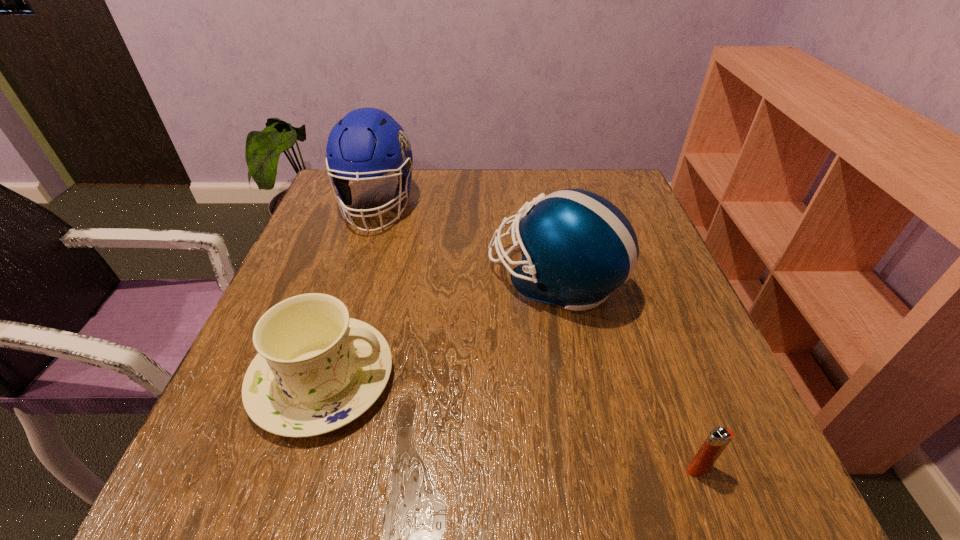
What are the coordinates of `vacant area that lies between the nearer football helmet and the third tallest object` in the screenshot? It's located at (439, 329).

Where is `vacant area that lies between the second nearest object and the farthest object`? The width and height of the screenshot is (960, 540). vacant area that lies between the second nearest object and the farthest object is located at coordinates (349, 292).

Where is `vacant space that is in between the left football helmet and the rightmost object`? The height and width of the screenshot is (540, 960). vacant space that is in between the left football helmet and the rightmost object is located at coordinates (538, 338).

I want to click on vacant space that's between the chinaware and the nearest object, so click(x=511, y=424).

Where is `vacant area between the chinaware and the left football helmet`? vacant area between the chinaware and the left football helmet is located at coordinates (349, 292).

Where is `free spot between the farther football helmet and the igniter`? free spot between the farther football helmet and the igniter is located at coordinates (538, 338).

At what (x,y) coordinates should I click in order to perform the action: click on vacant space that is in between the igniter and the second shortest object. Please return your answer as a coordinate pair (x, y). Looking at the image, I should click on (511, 424).

Where is `the third closest object to the rightmost object`? the third closest object to the rightmost object is located at coordinates (367, 143).

In order to click on object that is the second closest to the chinaware in this screenshot , I will do `click(367, 143)`.

Locate an element on the screen. This screenshot has width=960, height=540. blank area in the image that satisfies the following two spatial constraints: 1. at the front of the right football helmet with the faceguard; 2. on the right side of the nearest object is located at coordinates (589, 469).